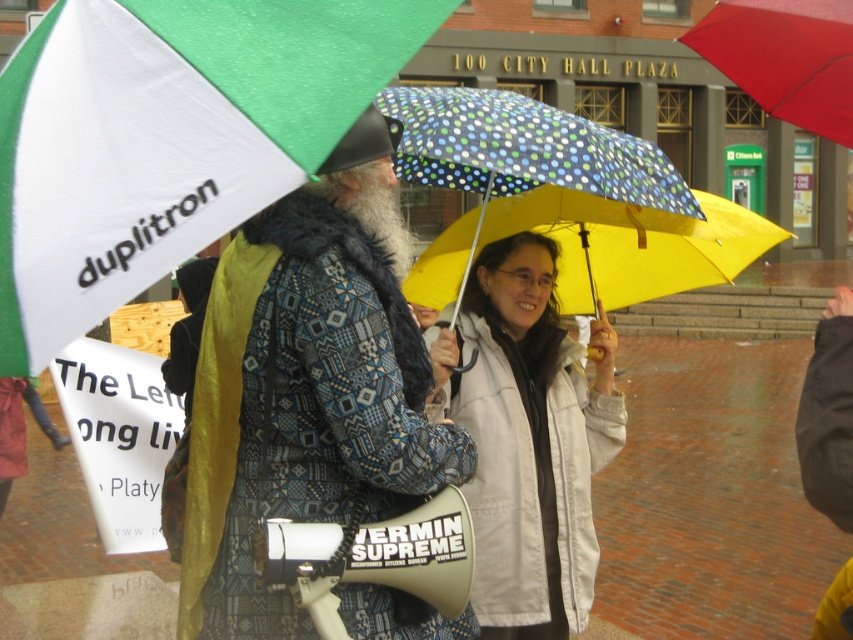
Between patterned fabric coat at center and yellowpolyesterumbrella at center, which one has more height?

patterned fabric coat at center is taller.

Is patterned fabric coat at center below yellowpolyesterumbrella at center?

Yes.

Does point (300, 384) come in front of point (660, 234)?

Yes.

In order to click on patterned fabric coat at center in this screenshot , I will do `click(306, 387)`.

Does point (519, 316) come in front of point (830, 72)?

No, it is behind (830, 72).

Who is positioned more to the left, white matte jacket at center or red matte umbrella at upper right?

From the viewer's perspective, white matte jacket at center appears more on the left side.

Locate an element on the screen. Image resolution: width=853 pixels, height=640 pixels. white matte jacket at center is located at coordinates (527, 440).

Looking at this image, which of these two, green fabric umbrella at upper left or patterned fabric coat at center, stands shorter?

Standing shorter between the two is green fabric umbrella at upper left.

Does point (48, 177) come closer to viewer compared to point (347, 483)?

Yes.

Identify the location of green fabric umbrella at upper left. This screenshot has width=853, height=640. (166, 138).